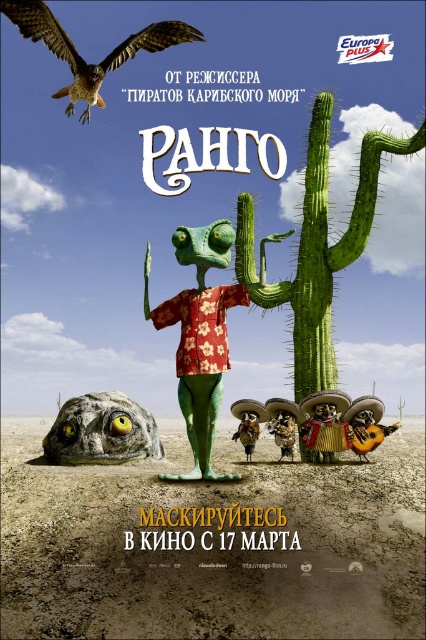
You are a movie poster designer and need to ensure the green matte lizard at center and the brown feathered falcon at upper left are positioned correctly. According to the design specifications, the minimum distance between characters should be 15 feet to avoid overcrowding. Does the current spacing meet this requirement?

The green matte lizard at center is 15.35 feet away from the brown feathered falcon at upper left, which exceeds the minimum requirement of 15 feet. Therefore, the spacing meets the design specifications.

You are standing in front of the movie poster for Rango. You notice two points marked on the poster. The first point is at coordinates point [172,234] and the second is at point [170,20]. Which point is closer to you?

Point [172,234] is closer to the viewer than point [170,20].